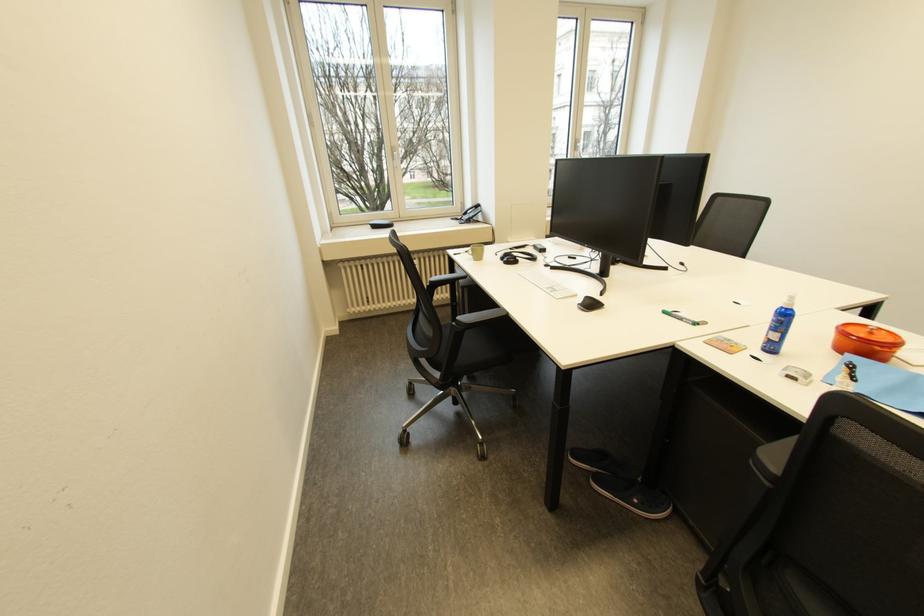
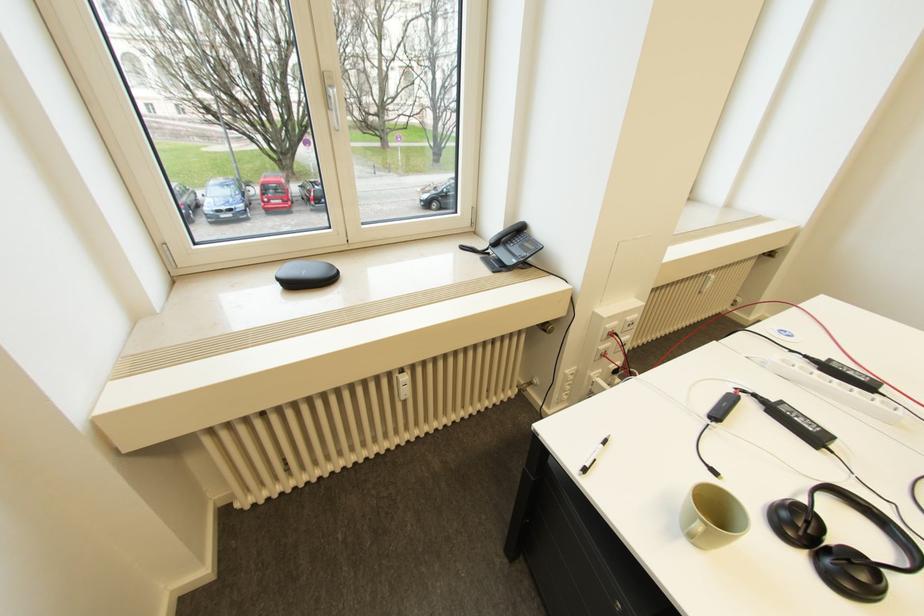
Locate, in the second image, the point that corresponds to (x=384, y=228) in the first image.

(301, 285)